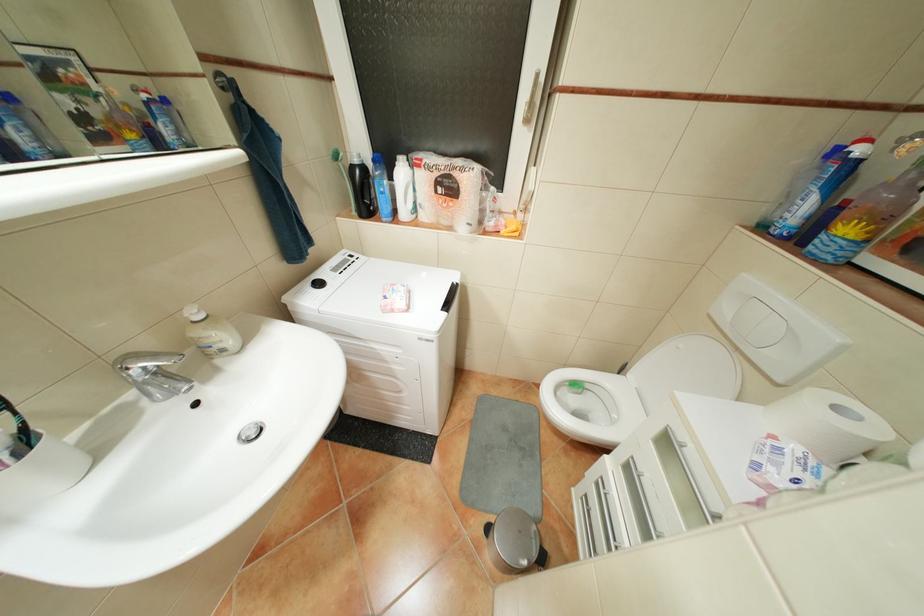
The image size is (924, 616). I want to click on toilet paper roll, so click(827, 424).